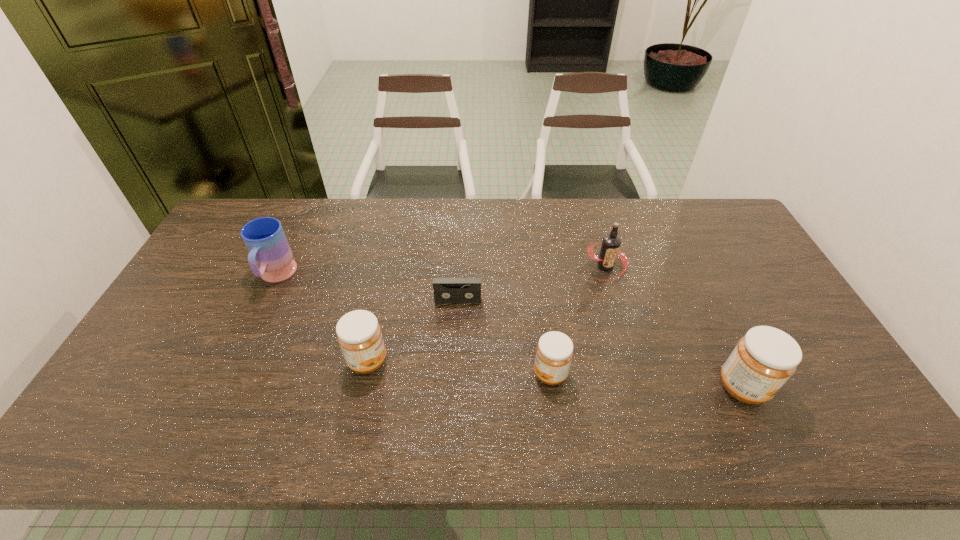
Locate an element on the screen. object that is the nearest to the root beer is located at coordinates (554, 352).

Select which object is the fourth closest to the fourth object from right to left. Please provide its 2D coordinates. Your answer should be formatted as a tuple, i.e. [(x, y)], where the tuple contains the x and y coordinates of a point satisfying the conditions above.

[(270, 257)]

Where is `jam that stands as the closest to the leftmost object`? jam that stands as the closest to the leftmost object is located at coordinates (359, 335).

Where is `the closest jam to the leftmost jam`? Image resolution: width=960 pixels, height=540 pixels. the closest jam to the leftmost jam is located at coordinates tap(554, 352).